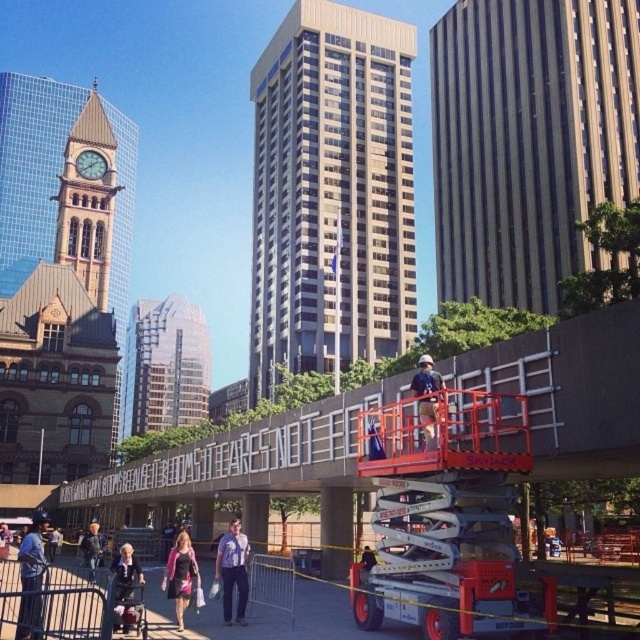
Is gold glass skyscraper at center to the right of blue striped shirt at center from the viewer's perspective?

No, gold glass skyscraper at center is not to the right of blue striped shirt at center.

Looking at this image, does gold glass skyscraper at center appear on the left side of blue striped shirt at center?

Correct, you'll find gold glass skyscraper at center to the left of blue striped shirt at center.

Does point (266, 276) come in front of point (241, 525)?

No, it is behind (241, 525).

You are a GUI agent. You are given a task and a screenshot of the screen. Output one action in this format:
    pyautogui.click(x=<x>, y=<y>)
    Task: Click on the gold glass skyscraper at center
    
    Given the screenshot: What is the action you would take?
    pos(332,193)

Based on the photo, can you confirm if brown textured building at upper right is positioned to the right of white concrete sign at center?

Yes, brown textured building at upper right is to the right of white concrete sign at center.

Can you confirm if brown textured building at upper right is bigger than white concrete sign at center?

Indeed, brown textured building at upper right has a larger size compared to white concrete sign at center.

Which is in front, point (531, 173) or point (490, 346)?

Point (490, 346)

Find the location of a particular element. This screenshot has width=640, height=640. brown textured building at upper right is located at coordinates (529, 140).

Who is positioned more to the right, denim jacket at lower left or matte pink dress at center?

matte pink dress at center

Measure the distance between denim jacket at lower left and camera.

The distance of denim jacket at lower left from camera is 21.18 meters.

The image size is (640, 640). What are the coordinates of `denim jacket at lower left` in the screenshot? It's located at (33, 554).